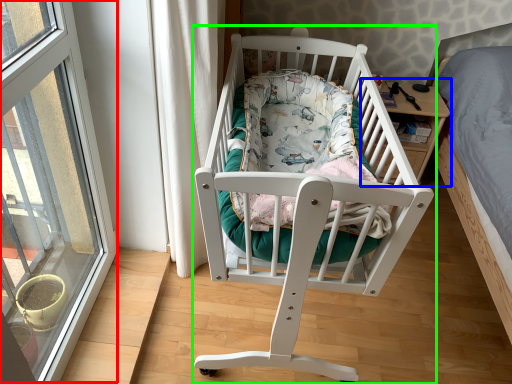
Question: Estimate the real-world distances between objects in this image. Which object is farther from window (highlighted by a red box), table (highlighted by a blue box) or infant bed (highlighted by a green box)?

Choices:
 (A) table
 (B) infant bed

Answer: (A)